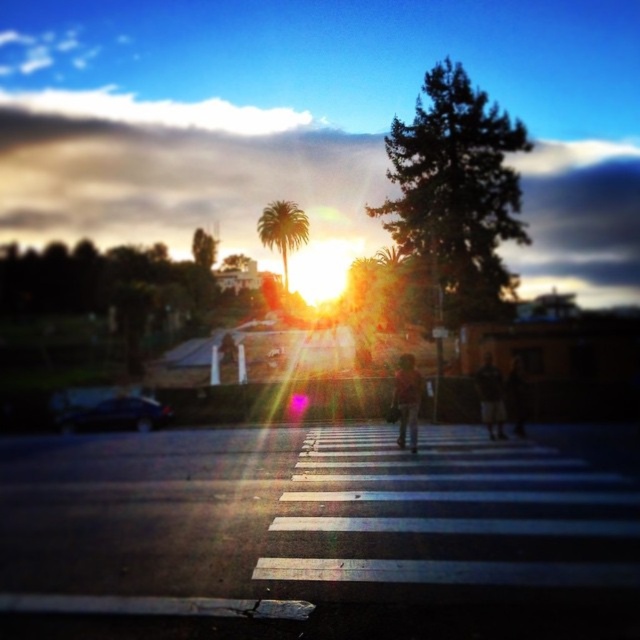
Question: Which point is farther to the camera?

Choices:
 (A) (413, 419)
 (B) (496, 410)
 (C) (301, 214)

Answer: (C)

Question: Which of the following is the closest to the observer?

Choices:
 (A) orange fabric bag at center
 (B) dark brown leather jacket at center
 (C) green leafy palm tree at center
 (D) camouflage fabric jacket at center

Answer: (A)

Question: Is green leafy palm tree at center closer to the viewer compared to dark brown leather jacket at center?

Choices:
 (A) no
 (B) yes

Answer: (A)

Question: Considering the relative positions of orange fabric bag at center and camouflage fabric jacket at center in the image provided, where is orange fabric bag at center located with respect to camouflage fabric jacket at center?

Choices:
 (A) right
 (B) left

Answer: (B)

Question: Which object appears closest to the camera in this image?

Choices:
 (A) camouflage fabric jacket at center
 (B) green leafy palm tree at center
 (C) orange fabric bag at center
 (D) dark brown leather jacket at center

Answer: (C)

Question: Is green leafy palm tree at center wider than orange fabric bag at center?

Choices:
 (A) yes
 (B) no

Answer: (A)